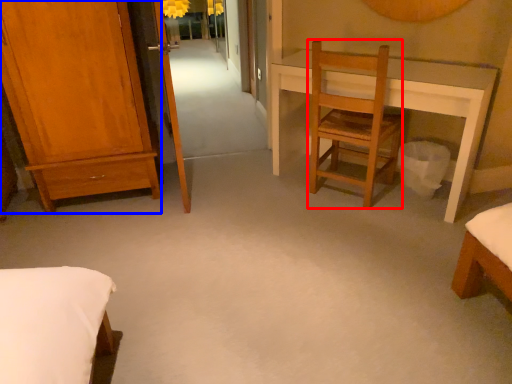
Question: Among these objects, which one is nearest to the camera, chair (highlighted by a red box) or furniture (highlighted by a blue box)?

Choices:
 (A) chair
 (B) furniture

Answer: (B)